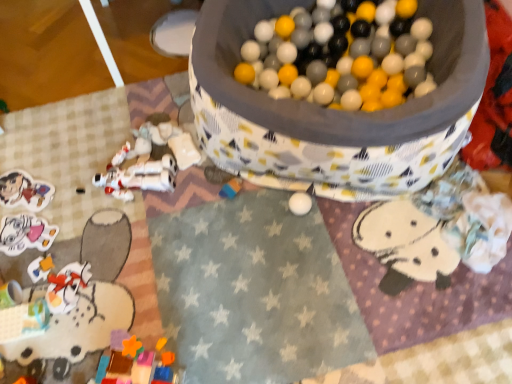
The height and width of the screenshot is (384, 512). Find the location of `free spot in front of white plastic astronaut at lower left, placed as the 4th toy when sorted from left to right`. free spot in front of white plastic astronaut at lower left, placed as the 4th toy when sorted from left to right is located at coordinates (130, 235).